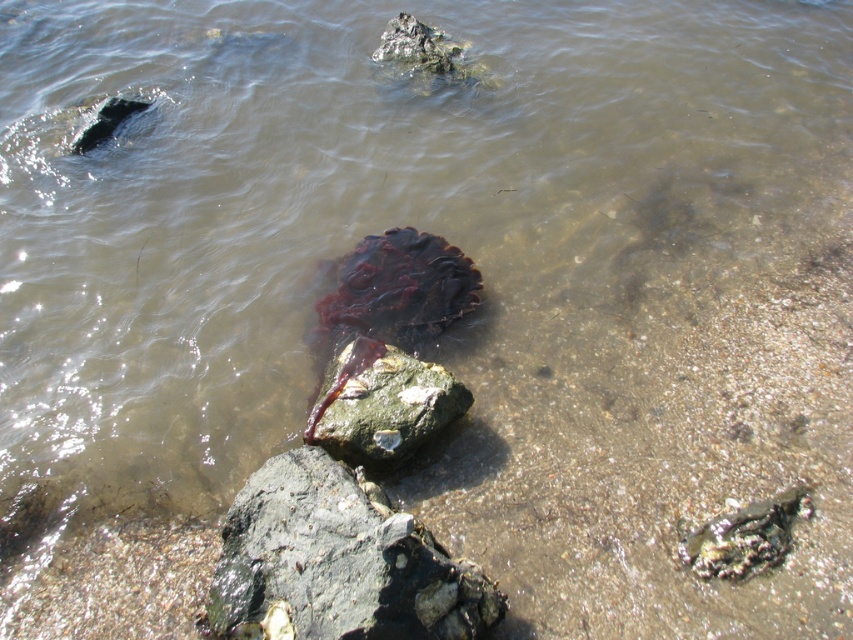
Can you confirm if rough gray rock at center is smaller than green mossy rock at center?

Actually, rough gray rock at center might be larger than green mossy rock at center.

Is rough gray rock at center to the right of green mossy rock at center from the viewer's perspective?

No, rough gray rock at center is not to the right of green mossy rock at center.

Is point (364, 552) farther from viewer compared to point (345, 406)?

No.

Find the location of a particular element. rough gray rock at center is located at coordinates (337, 563).